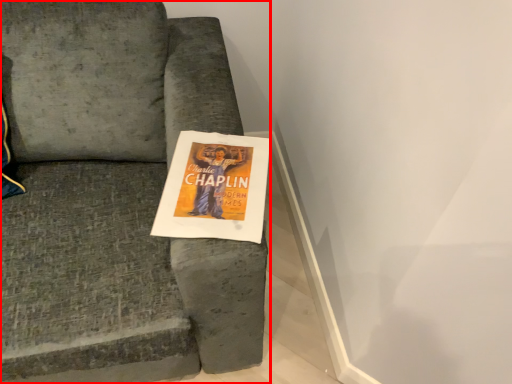
Question: From the image's perspective, where is chair (annotated by the red box) located in relation to flyer in the image?

Choices:
 (A) below
 (B) above

Answer: (B)